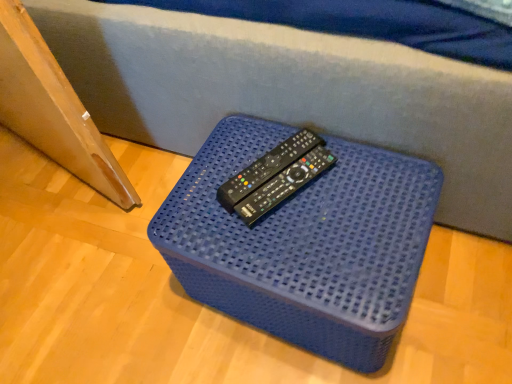
Find the location of a particular element. vacant area on the back side of black plastic remote at center is located at coordinates (255, 132).